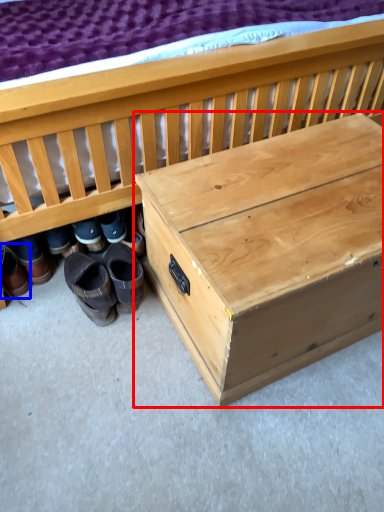
Question: Which object is closer to the camera taking this photo, table (highlighted by a red box) or footwear (highlighted by a blue box)?

Choices:
 (A) table
 (B) footwear

Answer: (A)